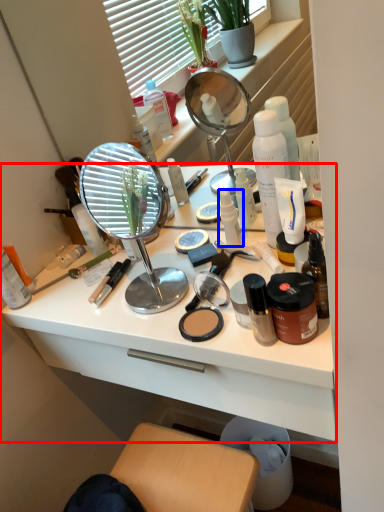
Question: Which object is closer to the camera taking this photo, desk (highlighted by a red box) or toiletry (highlighted by a blue box)?

Choices:
 (A) desk
 (B) toiletry

Answer: (A)